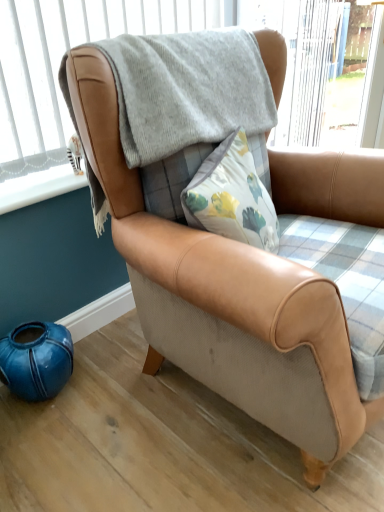
Question: Is plaid fabric window frame at upper center touching white plastic window sill at lower left?

Choices:
 (A) no
 (B) yes

Answer: (A)

Question: Is plaid fabric window frame at upper center bigger than white plastic window sill at lower left?

Choices:
 (A) no
 (B) yes

Answer: (B)

Question: From the image's perspective, does plaid fabric window frame at upper center appear lower than white plastic window sill at lower left?

Choices:
 (A) yes
 (B) no

Answer: (B)

Question: Is plaid fabric window frame at upper center in front of white plastic window sill at lower left?

Choices:
 (A) yes
 (B) no

Answer: (A)

Question: Would you say plaid fabric window frame at upper center contains white plastic window sill at lower left?

Choices:
 (A) yes
 (B) no

Answer: (B)

Question: Considering the relative positions of plaid fabric window frame at upper center and white plastic window sill at lower left in the image provided, is plaid fabric window frame at upper center to the right of white plastic window sill at lower left from the viewer's perspective?

Choices:
 (A) yes
 (B) no

Answer: (A)

Question: Is white plastic window sill at lower left thinner than plaid fabric window frame at upper center?

Choices:
 (A) no
 (B) yes

Answer: (B)

Question: Would you say plaid fabric window frame at upper center is part of white plastic window sill at lower left's contents?

Choices:
 (A) no
 (B) yes

Answer: (A)

Question: Does white plastic window sill at lower left have a smaller size compared to plaid fabric window frame at upper center?

Choices:
 (A) yes
 (B) no

Answer: (A)

Question: From the image's perspective, is white plastic window sill at lower left under plaid fabric window frame at upper center?

Choices:
 (A) no
 (B) yes

Answer: (B)

Question: Is white plastic window sill at lower left closer to camera compared to plaid fabric window frame at upper center?

Choices:
 (A) no
 (B) yes

Answer: (A)

Question: Does white plastic window sill at lower left come behind plaid fabric window frame at upper center?

Choices:
 (A) yes
 (B) no

Answer: (A)

Question: From a real-world perspective, relative to white plastic window sill at lower left, is plaid fabric window frame at upper center vertically above or below?

Choices:
 (A) below
 (B) above

Answer: (B)